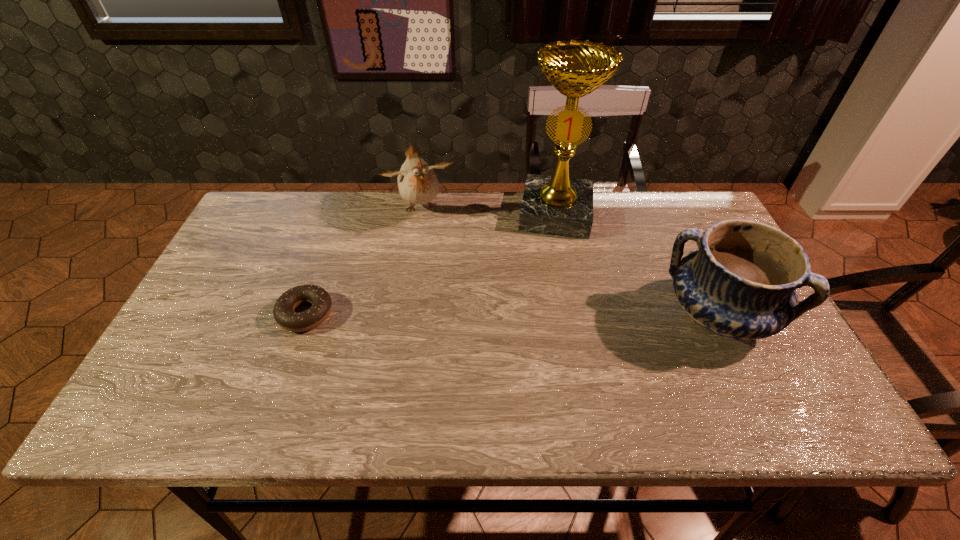
Identify the location of vacant region at the near edge of the desktop. The width and height of the screenshot is (960, 540). (373, 363).

Find the location of a particular element. This screenshot has width=960, height=540. free location at the left edge of the desktop is located at coordinates (272, 254).

Identify the location of vacant space at the far left corner. (242, 234).

Image resolution: width=960 pixels, height=540 pixels. In the image, there is a desktop. Identify the location of vacant space at the far right corner. (702, 217).

Locate an element on the screen. vacant area that lies between the rightmost object and the doughnut is located at coordinates (512, 314).

Identify the location of vacant area between the rightmost object and the shortest object. (512, 314).

This screenshot has width=960, height=540. I want to click on free spot between the bird and the shortest object, so click(363, 261).

You are a GUI agent. You are given a task and a screenshot of the screen. Output one action in this format:
    pyautogui.click(x=<x>, y=<y>)
    Task: Click on the free space that is in between the tallest object and the bird
    The width and height of the screenshot is (960, 540).
    Given the screenshot: What is the action you would take?
    pyautogui.click(x=488, y=211)

Locate an element on the screen. free point between the second object from left to right and the doughnut is located at coordinates (363, 261).

Where is `free point between the pottery and the second object from left to right`? This screenshot has height=540, width=960. free point between the pottery and the second object from left to right is located at coordinates (568, 262).